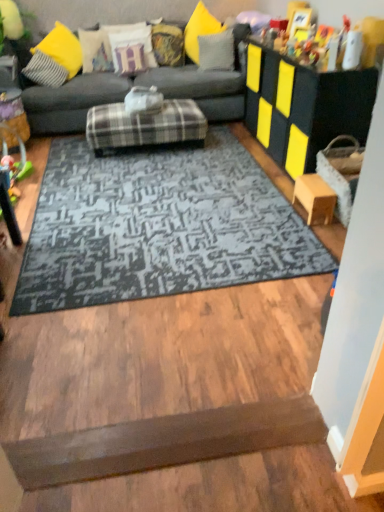
Question: Considering the relative sizes of brown matte doormat at lower center and plastic green toy at left in the image provided, is brown matte doormat at lower center shorter than plastic green toy at left?

Choices:
 (A) yes
 (B) no

Answer: (A)

Question: Would you consider brown matte doormat at lower center to be distant from plastic green toy at left?

Choices:
 (A) no
 (B) yes

Answer: (B)

Question: Does brown matte doormat at lower center come in front of plastic green toy at left?

Choices:
 (A) no
 (B) yes

Answer: (B)

Question: Does brown matte doormat at lower center appear on the right side of plastic green toy at left?

Choices:
 (A) yes
 (B) no

Answer: (A)

Question: Is brown matte doormat at lower center wider than plastic green toy at left?

Choices:
 (A) no
 (B) yes

Answer: (A)

Question: Choose the correct answer: Is textured cream pillow at upper left, placed as the 6th pillow when sorted from right to left, inside plaid fabric ottoman at center or outside it?

Choices:
 (A) inside
 (B) outside

Answer: (B)

Question: In terms of height, does textured cream pillow at upper left, placed as the 6th pillow when sorted from right to left, look taller or shorter compared to plaid fabric ottoman at center?

Choices:
 (A) tall
 (B) short

Answer: (A)

Question: In the image, is textured cream pillow at upper left, placed as the 6th pillow when sorted from right to left, on the left side or the right side of plaid fabric ottoman at center?

Choices:
 (A) left
 (B) right

Answer: (A)

Question: From a real-world perspective, is textured cream pillow at upper left, marked as the first pillow in a left-to-right arrangement, positioned above or below plaid fabric ottoman at center?

Choices:
 (A) above
 (B) below

Answer: (A)

Question: In terms of height, does plaid fabric ottoman at center look taller or shorter compared to gray fabric pillow at upper center, positioned as the 6th pillow in left-to-right order?

Choices:
 (A) tall
 (B) short

Answer: (B)

Question: Considering the positions of point (192, 139) and point (203, 35), is point (192, 139) closer or farther from the camera than point (203, 35)?

Choices:
 (A) farther
 (B) closer

Answer: (B)

Question: Based on their sizes in the image, would you say plaid fabric ottoman at center is bigger or smaller than gray fabric pillow at upper center, positioned as the 6th pillow in left-to-right order?

Choices:
 (A) big
 (B) small

Answer: (A)

Question: In the image, is plaid fabric ottoman at center on the left side or the right side of gray fabric pillow at upper center, which appears as the 1th pillow when viewed from the right?

Choices:
 (A) left
 (B) right

Answer: (A)

Question: In terms of size, does wooden table at right, marked as the second table in a top-to-bottom arrangement, appear bigger or smaller than plastic green toy at left?

Choices:
 (A) small
 (B) big

Answer: (A)

Question: Is wooden table at right, marked as the second table in a top-to-bottom arrangement, in front of or behind plastic green toy at left in the image?

Choices:
 (A) behind
 (B) front

Answer: (B)